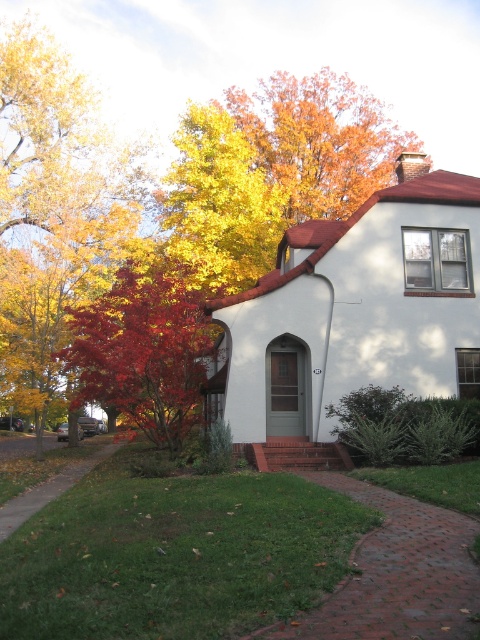
Question: Can you confirm if shiny red maple tree at left is positioned above golden leafy tree at upper center?

Choices:
 (A) no
 (B) yes

Answer: (A)

Question: Does orange leafy tree at upper center lie in front of golden leafy tree at upper center?

Choices:
 (A) no
 (B) yes

Answer: (A)

Question: Which point is farther to the camera?

Choices:
 (A) (415, 138)
 (B) (175, 348)

Answer: (A)

Question: Does orange leafy tree at upper center have a larger size compared to golden leafy tree at upper center?

Choices:
 (A) yes
 (B) no

Answer: (B)

Question: Which of these objects is positioned farthest from the orange leafy tree at upper center?

Choices:
 (A) golden leafy tree at upper center
 (B) shiny red maple tree at left

Answer: (B)

Question: Which point is closer to the camera?

Choices:
 (A) (192, 204)
 (B) (172, 445)

Answer: (B)